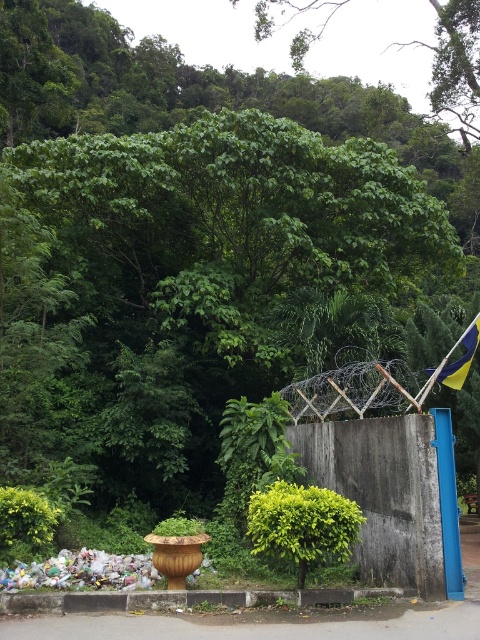
Which is behind, point (289, 49) or point (6, 586)?

The point (289, 49) is more distant.

Between green leafy tree at upper center and plastic trash at lower left, which one appears on the left side from the viewer's perspective?

plastic trash at lower left

Between point (303, 3) and point (73, 570), which one is positioned in front?

Point (73, 570) is more forward.

Find the location of `green leafy tree at upper center`. green leafy tree at upper center is located at coordinates (455, 67).

Which of these two, green leafy tree at upper center or yellow fabric flag at right, stands taller?

green leafy tree at upper center

Does green leafy tree at upper center lie in front of yellow fabric flag at right?

No, green leafy tree at upper center is behind yellow fabric flag at right.

What do you see at coordinates (455, 67) in the screenshot? I see `green leafy tree at upper center` at bounding box center [455, 67].

This screenshot has height=640, width=480. In order to click on green leafy tree at upper center in this screenshot , I will do `click(455, 67)`.

Is plastic trash at lower left shorter than yellow fabric flag at right?

Correct, plastic trash at lower left is not as tall as yellow fabric flag at right.

Is point (72, 556) closer to viewer compared to point (456, 364)?

No, (72, 556) is further to viewer.

Describe the element at coordinates (82, 572) in the screenshot. I see `plastic trash at lower left` at that location.

Find the location of a particular element. This screenshot has height=640, width=480. plastic trash at lower left is located at coordinates pyautogui.click(x=82, y=572).